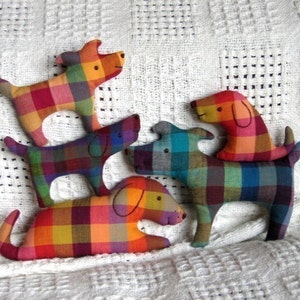
Where is `stuffed animal`? stuffed animal is located at coordinates (227, 171), (243, 153), (68, 151), (105, 215), (58, 104).